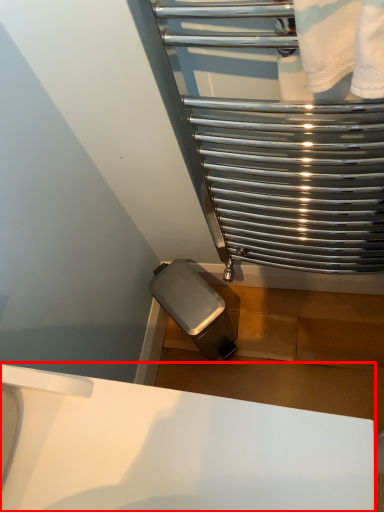
Question: From the image's perspective, where is sink (annotated by the red box) located in relation to glass door in the image?

Choices:
 (A) above
 (B) below

Answer: (B)